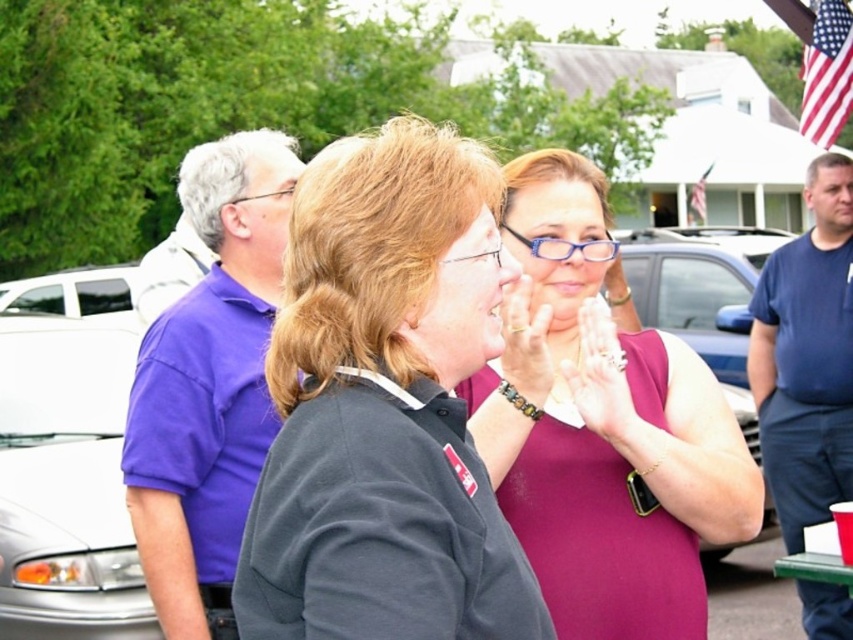
Who is more distant from viewer, (358, 365) or (225, 253)?

The point (225, 253) is more distant.

The width and height of the screenshot is (853, 640). In order to click on dark gray shirt at center in this screenshot , I will do `click(384, 406)`.

Does purple cotton polo shirt at left have a greater height compared to smooth skin hands at center?

Yes.

Who is more forward, (158, 531) or (598, 401)?

Point (598, 401)

What do you see at coordinates (209, 385) in the screenshot?
I see `purple cotton polo shirt at left` at bounding box center [209, 385].

At what (x,y) coordinates should I click in order to perform the action: click on purple cotton polo shirt at left. Please return your answer as a coordinate pair (x, y). This screenshot has width=853, height=640. Looking at the image, I should click on (209, 385).

Can you confirm if dark gray shirt at center is positioned above dark blue t-shirt at right?

Correct, dark gray shirt at center is located above dark blue t-shirt at right.

You are a GUI agent. You are given a task and a screenshot of the screen. Output one action in this format:
    pyautogui.click(x=<x>, y=<y>)
    Task: Click on the dark gray shirt at center
    This screenshot has height=640, width=853.
    Given the screenshot: What is the action you would take?
    pyautogui.click(x=384, y=406)

Where is `dark gray shirt at center`? This screenshot has height=640, width=853. dark gray shirt at center is located at coordinates (384, 406).